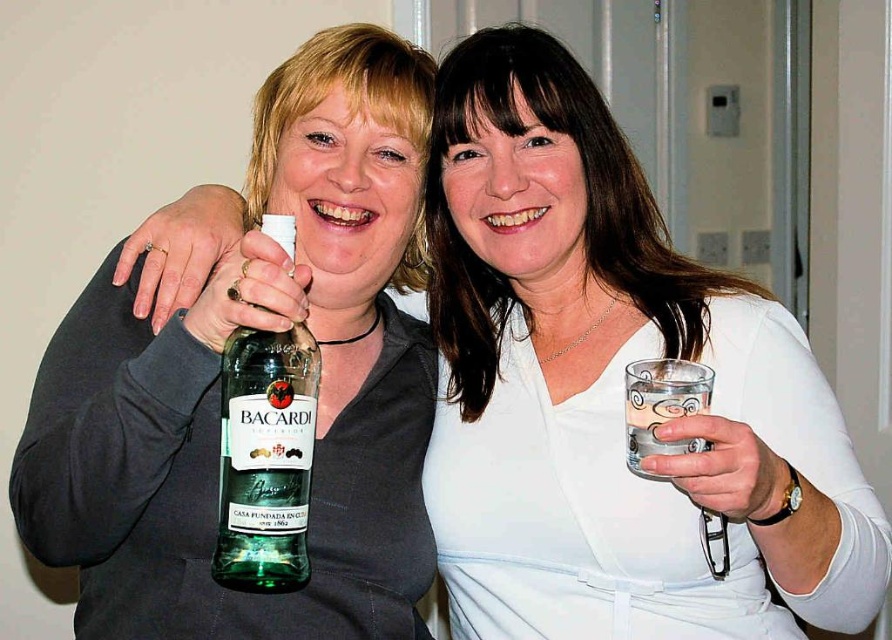
You are a photographer who wants to place a decorative ribbon at a specific location in the image. The coordinates given are point [265,458]. Where should you place the ribbon?

The point [265,458] corresponds to the green glass bottle at center, so you should place the ribbon there.

You are a bartender preparing drinks for a party. You need to place the green glass bottle at center and the clear glass at right on a shelf. The shelf has limited space. Which object should you place first to ensure both fit properly?

The green glass bottle at center is located above the clear glass at right, so you should place the clear glass at right first on the shelf to ensure there is enough space below for the green glass bottle at center.

You are a photographer standing 36 inches away from the scene. You want to take a closeup shot of the green glass bottle at center. Can you reach it with your hand without moving your body? Assume your arm can extend 36 inches.

The green glass bottle at center is 31.81 inches away from the viewer. Since your arm can extend 36 inches, which is longer than the distance to the bottle, you can reach it without moving your body.